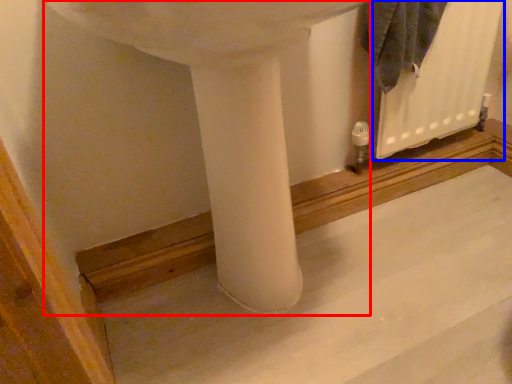
Question: Among these objects, which one is farthest to the camera, sink (highlighted by a red box) or radiator (highlighted by a blue box)?

Choices:
 (A) sink
 (B) radiator

Answer: (B)